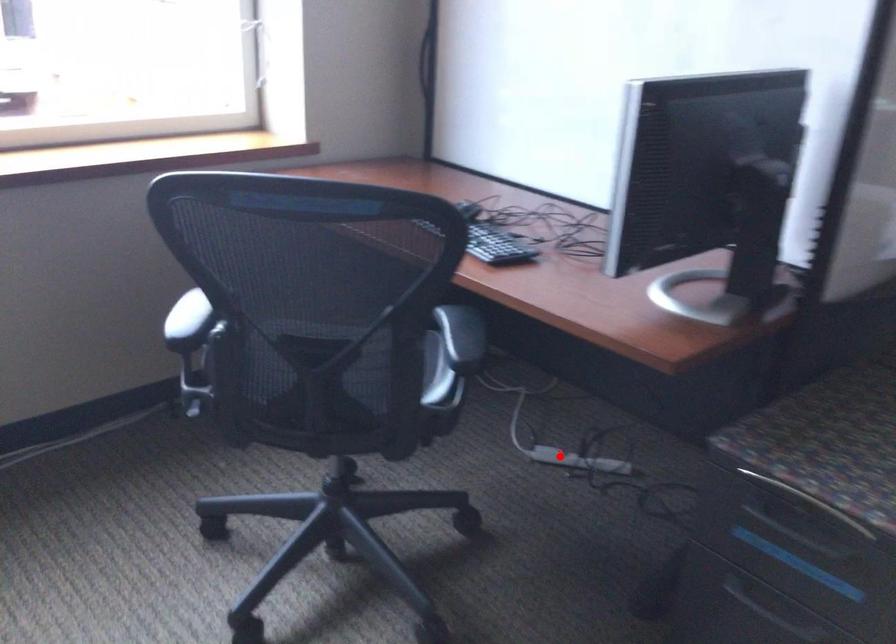
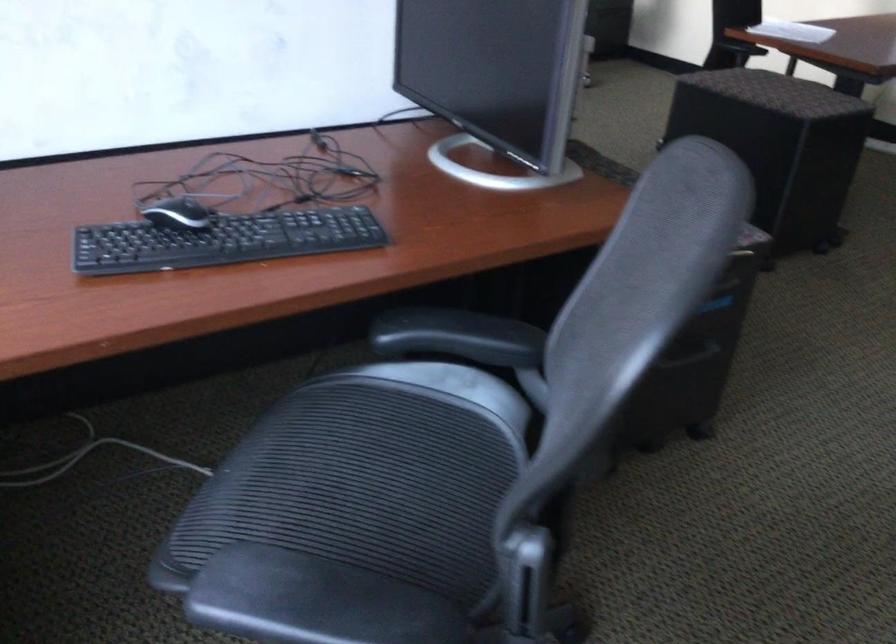
Question: I am providing you with two images of the same scene from different viewpoints. A red point is marked on the first image. Is the red point's position out of view in image 2?

Choices:
 (A) Yes
 (B) No

Answer: (A)